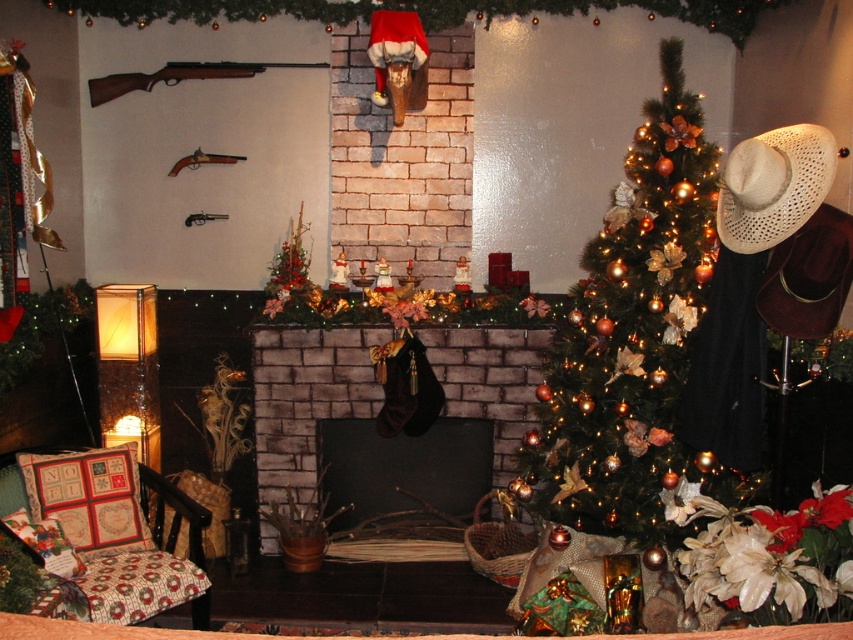
You are planning to place a small gift box on the surface of the green matte christmas tree at center and the beige woven cowboy hat at right. Which object can the gift box fit on?

The green matte christmas tree at center is larger in size than the beige woven cowboy hat at right, so the gift box can fit on the green matte christmas tree at center.

You are standing in the room and want to place a new holiday decoration exactly at the center of the brick fireplace at center. According to the coordinates provided, where should you place it?

The brick fireplace at center should have its decoration placed at the coordinates point [306,397] as specified in the description.

You are standing in the festive room and want to place a small gift between the two points marked as point (457, 388) and point (757, 205). Based on their positions, which point should the gift be closer to if it needs to be near the fireplace?

The gift should be closer to point (757, 205) because point (457, 388) is behind it, meaning the closer point to the fireplace area would be point (757, 205).